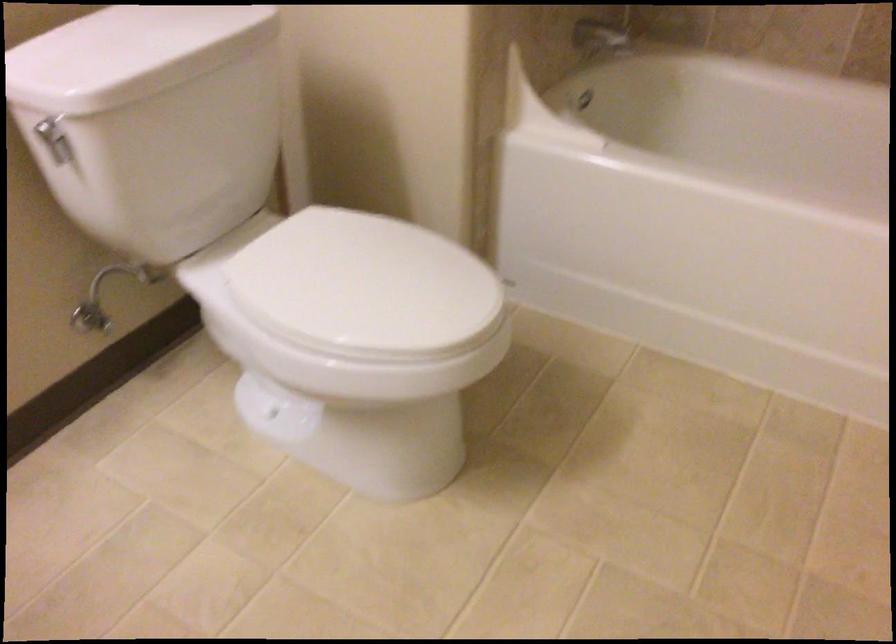
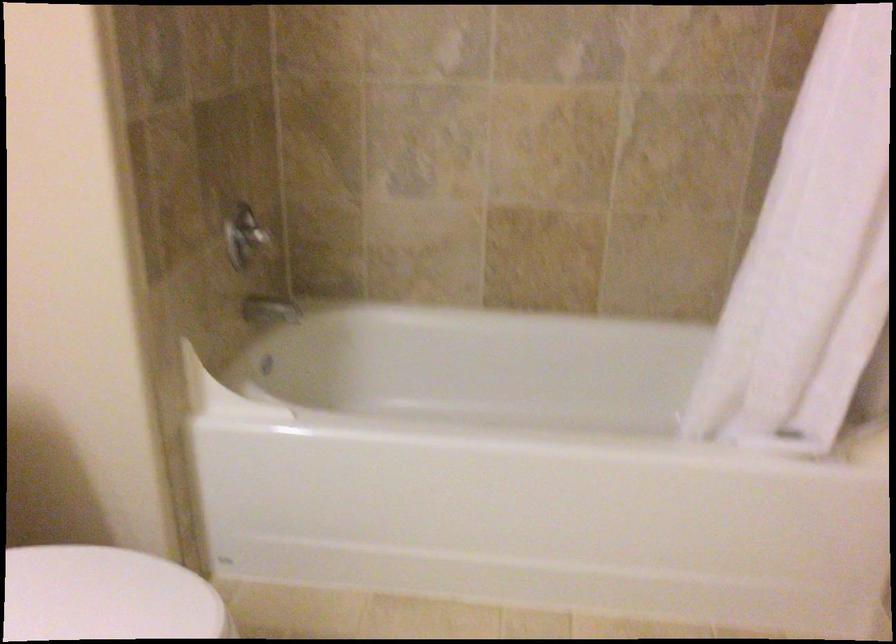
Question: The images are taken continuously from a first-person perspective. In which direction is your viewpoint rotating?

Choices:
 (A) Left
 (B) Right
 (C) Up
 (D) Down

Answer: (B)